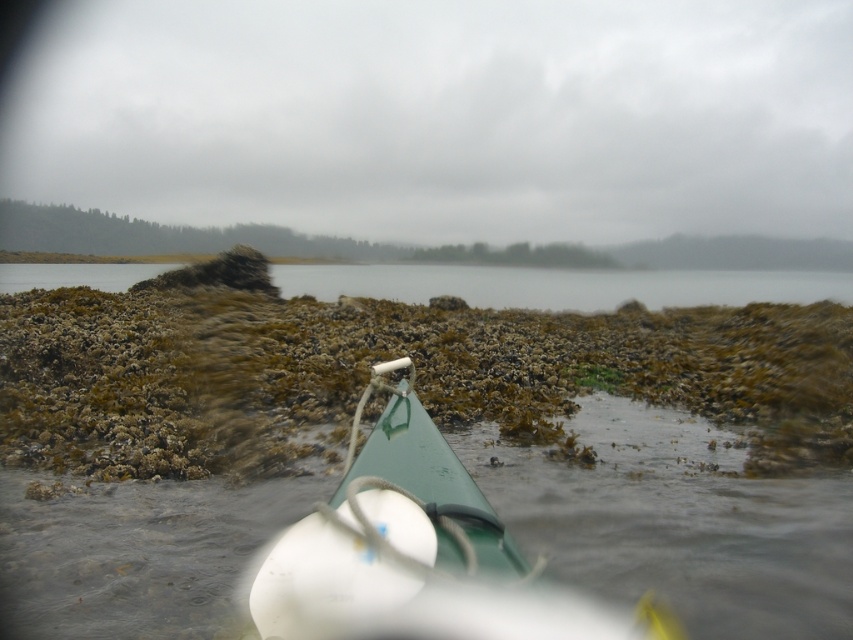
Question: In this image, where is green matte boat at center located relative to brown algae-covered rocks at lower center?

Choices:
 (A) below
 (B) above

Answer: (A)

Question: Among these points, which one is nearest to the camera?

Choices:
 (A) (361, 500)
 (B) (136, 264)

Answer: (A)

Question: Which object is farther from the camera taking this photo?

Choices:
 (A) brown algae-covered rocks at lower center
 (B) green rubber boat at center

Answer: (A)

Question: Is green rubber boat at center positioned at the back of brown algae-covered rocks at lower center?

Choices:
 (A) no
 (B) yes

Answer: (A)

Question: Can you confirm if green rubber boat at center is positioned above green matte boat at center?

Choices:
 (A) yes
 (B) no

Answer: (A)

Question: Which point appears closest to the camera in this image?

Choices:
 (A) (457, 596)
 (B) (492, 484)

Answer: (A)